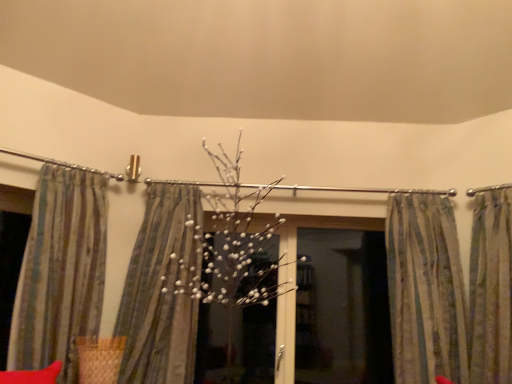
Measure the distance between striped fabric curtain at right, positioned as the 2th curtain in right-to-left order, and camera.

They are 6.97 feet apart.

What do you see at coordinates (340, 305) in the screenshot?
I see `transparent glass screen door at center` at bounding box center [340, 305].

What do you see at coordinates (160, 291) in the screenshot?
I see `striped fabric at center, the third curtain positioned from the right` at bounding box center [160, 291].

Identify the location of metallic silver clothesline at upper left. (63, 164).

Identify the location of striped fabric curtain at right, positioned as the 2th curtain in right-to-left order. The image size is (512, 384). (450, 290).

Is striped fabric curtain at left, the 4th curtain from the right, not near striped fabric curtain at right, the 4th curtain positioned from the left?

Indeed, striped fabric curtain at left, the 4th curtain from the right, is not near striped fabric curtain at right, the 4th curtain positioned from the left.

Considering the relative positions of striped fabric curtain at left, the 4th curtain from the right, and striped fabric curtain at right, the first curtain positioned from the right, in the image provided, is striped fabric curtain at left, the 4th curtain from the right, in front of striped fabric curtain at right, the first curtain positioned from the right,?

Yes, it is in front of striped fabric curtain at right, the first curtain positioned from the right.

Between striped fabric curtain at left, acting as the 1th curtain starting from the left, and striped fabric curtain at right, the first curtain positioned from the right, which one has less height?

striped fabric curtain at right, the first curtain positioned from the right.

Which of these two, transparent glass screen door at center or striped fabric curtain at left, acting as the 1th curtain starting from the left, is smaller?

transparent glass screen door at center.

Are transparent glass screen door at center and striped fabric curtain at left, acting as the 1th curtain starting from the left, located far from each other?

Yes, transparent glass screen door at center and striped fabric curtain at left, acting as the 1th curtain starting from the left, are quite far apart.

Considering the relative sizes of transparent glass screen door at center and striped fabric curtain at left, acting as the 1th curtain starting from the left, in the image provided, is transparent glass screen door at center wider than striped fabric curtain at left, acting as the 1th curtain starting from the left,?

No, transparent glass screen door at center is not wider than striped fabric curtain at left, acting as the 1th curtain starting from the left.

Is transparent glass screen door at center oriented towards striped fabric curtain at left, acting as the 1th curtain starting from the left?

No, transparent glass screen door at center does not turn towards striped fabric curtain at left, acting as the 1th curtain starting from the left.

Which is behind, transparent glass screen door at center or striped fabric at center, the third curtain positioned from the right?

Positioned behind is transparent glass screen door at center.

Does point (385, 338) appear closer or farther from the camera than point (172, 308)?

Clearly, point (385, 338) is more distant from the camera than point (172, 308).

From a real-world perspective, is transparent glass screen door at center located beneath striped fabric at center, the third curtain positioned from the right?

Indeed, from a real-world perspective, transparent glass screen door at center is positioned beneath striped fabric at center, the third curtain positioned from the right.

Is transparent glass screen door at center oriented away from striped fabric at center, the second curtain from the left?

transparent glass screen door at center is not turned away from striped fabric at center, the second curtain from the left.

Which object is thinner, metallic silver clothesline at upper left or transparent glass screen door at center?

With smaller width is metallic silver clothesline at upper left.

From a real-world perspective, which object rests below the other?

From a 3D spatial view, transparent glass screen door at center is below.

Consider the image. Does metallic silver clothesline at upper left have a larger size compared to transparent glass screen door at center?

No.

Between metallic silver clothesline at upper left and transparent glass screen door at center, which one appears on the left side from the viewer's perspective?

metallic silver clothesline at upper left is more to the left.

Considering the sizes of objects striped fabric curtain at right, the first curtain positioned from the right, and striped fabric curtain at left, the 4th curtain from the right, in the image provided, who is smaller, striped fabric curtain at right, the first curtain positioned from the right, or striped fabric curtain at left, the 4th curtain from the right,?

With smaller size is striped fabric curtain at right, the first curtain positioned from the right.

Consider the image. Is striped fabric curtain at right, the 4th curtain positioned from the left, situated inside striped fabric curtain at left, the 4th curtain from the right, or outside?

striped fabric curtain at right, the 4th curtain positioned from the left, cannot be found inside striped fabric curtain at left, the 4th curtain from the right.

Is striped fabric curtain at right, the 4th curtain positioned from the left, oriented away from striped fabric curtain at left, the 4th curtain from the right?

No, striped fabric curtain at right, the 4th curtain positioned from the left, is not facing away from striped fabric curtain at left, the 4th curtain from the right.

Between striped fabric curtain at right, the 4th curtain positioned from the left, and striped fabric at center, the second curtain from the left, which one appears on the right side from the viewer's perspective?

From the viewer's perspective, striped fabric curtain at right, the 4th curtain positioned from the left, appears more on the right side.

From the picture: Is striped fabric curtain at right, the 4th curtain positioned from the left, oriented towards striped fabric at center, the third curtain positioned from the right?

No.

Is striped fabric curtain at right, the first curtain positioned from the right, positioned far away from striped fabric at center, the third curtain positioned from the right?

striped fabric curtain at right, the first curtain positioned from the right, is far away from striped fabric at center, the third curtain positioned from the right.

Is striped fabric curtain at left, acting as the 1th curtain starting from the left, bigger or smaller than transparent glass screen door at center?

Considering their sizes, striped fabric curtain at left, acting as the 1th curtain starting from the left, takes up more space than transparent glass screen door at center.

Between striped fabric curtain at left, the 4th curtain from the right, and transparent glass screen door at center, which one appears on the right side from the viewer's perspective?

transparent glass screen door at center is more to the right.

Which is correct: striped fabric curtain at left, acting as the 1th curtain starting from the left, is inside transparent glass screen door at center, or outside of it?

striped fabric curtain at left, acting as the 1th curtain starting from the left, is not enclosed by transparent glass screen door at center.

Is striped fabric curtain at left, acting as the 1th curtain starting from the left, shorter than transparent glass screen door at center?

In fact, striped fabric curtain at left, acting as the 1th curtain starting from the left, may be taller than transparent glass screen door at center.

Image resolution: width=512 pixels, height=384 pixels. In order to click on curtain that is the 1st one when counting backward from the striped fabric curtain at left, acting as the 1th curtain starting from the left in this screenshot , I will do [x=490, y=286].

In order to click on the 3rd curtain located above the transparent glass screen door at center (from a real-world perspective) in this screenshot , I will do `click(60, 272)`.

Looking at the image, which one is located closer to transparent glass screen door at center, metallic silver clothesline at upper left or striped fabric curtain at left, acting as the 1th curtain starting from the left?

striped fabric curtain at left, acting as the 1th curtain starting from the left.

When comparing their distances from transparent glass screen door at center, does striped fabric at center, the third curtain positioned from the right, or metallic silver clothesline at upper left seem closer?

striped fabric at center, the third curtain positioned from the right, is positioned closer to the anchor transparent glass screen door at center.

In the scene shown: Considering their positions, is striped fabric at center, the second curtain from the left, positioned further to striped fabric curtain at right, the 4th curtain positioned from the left, than striped fabric curtain at left, acting as the 1th curtain starting from the left?

striped fabric curtain at left, acting as the 1th curtain starting from the left, is positioned further to the anchor striped fabric curtain at right, the 4th curtain positioned from the left.

When comparing their distances from striped fabric curtain at left, acting as the 1th curtain starting from the left, does striped fabric curtain at right, positioned as the 2th curtain in right-to-left order, or transparent glass screen door at center seem further?

Based on the image, striped fabric curtain at right, positioned as the 2th curtain in right-to-left order, appears to be further to striped fabric curtain at left, acting as the 1th curtain starting from the left.

Considering their positions, is striped fabric at center, the second curtain from the left, positioned closer to striped fabric curtain at left, the 4th curtain from the right, than transparent glass screen door at center?

striped fabric at center, the second curtain from the left.

Based on their spatial positions, is transparent glass screen door at center or striped fabric curtain at right, the third curtain viewed from the left, further from striped fabric curtain at right, the 4th curtain positioned from the left?

transparent glass screen door at center.

From the picture: When comparing their distances from striped fabric curtain at left, the 4th curtain from the right, does striped fabric curtain at right, positioned as the 2th curtain in right-to-left order, or striped fabric curtain at right, the 4th curtain positioned from the left, seem further?

striped fabric curtain at right, the 4th curtain positioned from the left, lies further to striped fabric curtain at left, the 4th curtain from the right, than the other object.

From the image, which object appears to be farther from transparent glass screen door at center, striped fabric curtain at right, positioned as the 2th curtain in right-to-left order, or striped fabric at center, the third curtain positioned from the right?

striped fabric at center, the third curtain positioned from the right, is positioned further to the anchor transparent glass screen door at center.

I want to click on screen door between metallic silver clothesline at upper left and striped fabric curtain at right, the third curtain viewed from the left, in the horizontal direction, so click(x=340, y=305).

Identify the location of screen door located between striped fabric curtain at left, the 4th curtain from the right, and striped fabric curtain at right, the 4th curtain positioned from the left, in the left-right direction. This screenshot has width=512, height=384. (340, 305).

Where is `screen door between striped fabric at center, the second curtain from the left, and striped fabric curtain at right, the third curtain viewed from the left, in the horizontal direction`? Image resolution: width=512 pixels, height=384 pixels. screen door between striped fabric at center, the second curtain from the left, and striped fabric curtain at right, the third curtain viewed from the left, in the horizontal direction is located at coordinates (340, 305).

The width and height of the screenshot is (512, 384). I want to click on curtain between striped fabric at center, the second curtain from the left, and striped fabric curtain at right, the 4th curtain positioned from the left, so click(x=450, y=290).